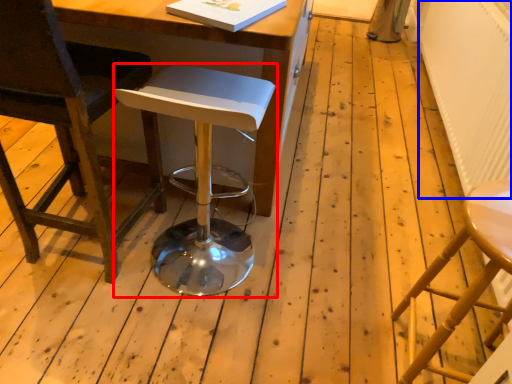
Question: Among these objects, which one is nearest to the camera, stool (highlighted by a red box) or radiator (highlighted by a blue box)?

Choices:
 (A) stool
 (B) radiator

Answer: (A)